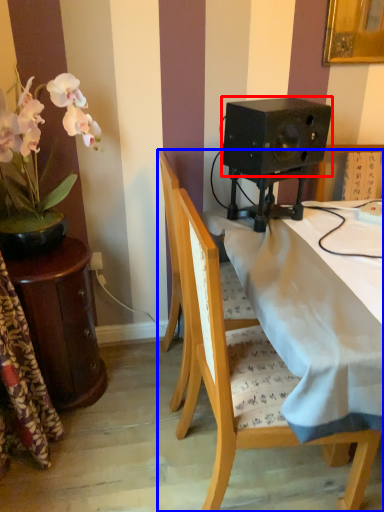
Question: Among these objects, which one is farthest to the camera, speaker (highlighted by a red box) or chair (highlighted by a blue box)?

Choices:
 (A) speaker
 (B) chair

Answer: (A)